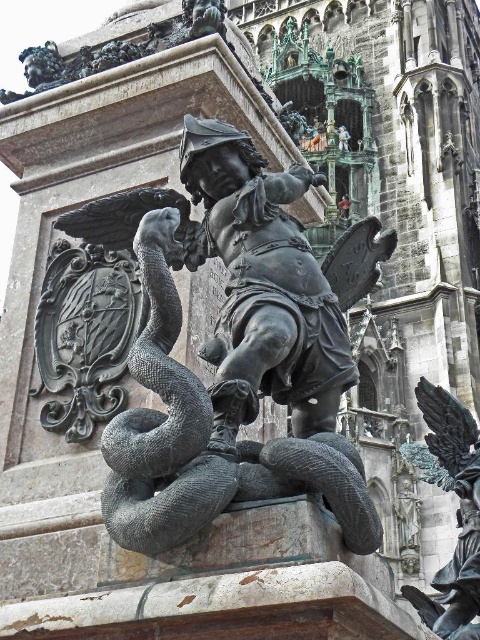
Question: Among these objects, which one is farthest from the camera?

Choices:
 (A) polished bronze snake at center
 (B) polished bronze eagle at center

Answer: (B)

Question: Is polished bronze snake at center thinner than polished bronze eagle at center?

Choices:
 (A) yes
 (B) no

Answer: (A)

Question: Is polished bronze snake at center to the left of polished bronze eagle at center from the viewer's perspective?

Choices:
 (A) yes
 (B) no

Answer: (A)

Question: Among these points, which one is farthest from the camera?

Choices:
 (A) (151, 326)
 (B) (474, 508)

Answer: (B)

Question: Can you confirm if polished bronze snake at center is thinner than polished bronze eagle at center?

Choices:
 (A) no
 (B) yes

Answer: (B)